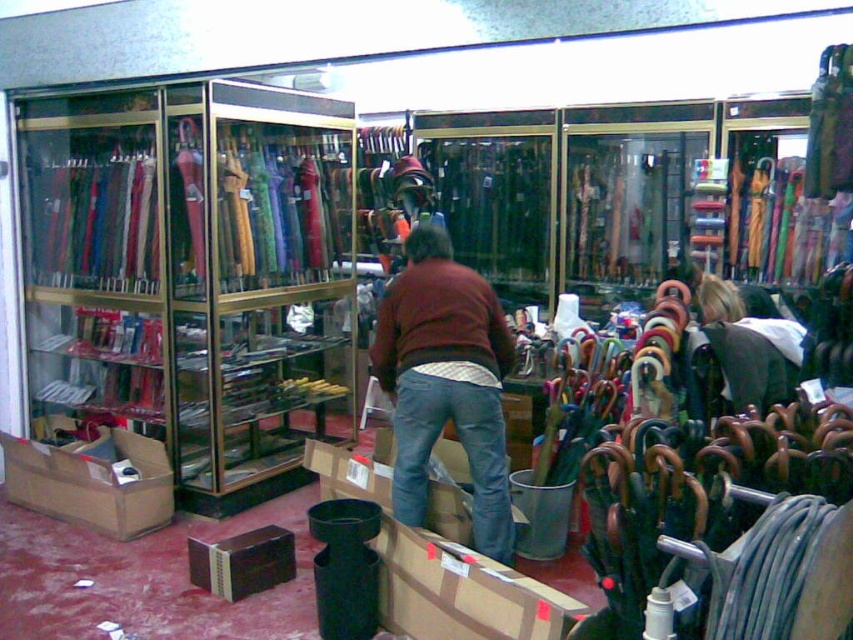
You are a customer in the store and want to pick up the brown sweater at center. Can you estimate where to reach for it based on the coordinates provided?

The brown sweater at center is located at coordinates point (445, 381), so you should reach towards the center of the image slightly to the right and lower middle area.

You are standing in the retail store and want to pick up an item located at point A and another item at point B. If point A corresponds to point [497,470] and point B is point [82,522], which point is closer to you?

Point A, which is point [497,470], is closer to you than point B, point [82,522].